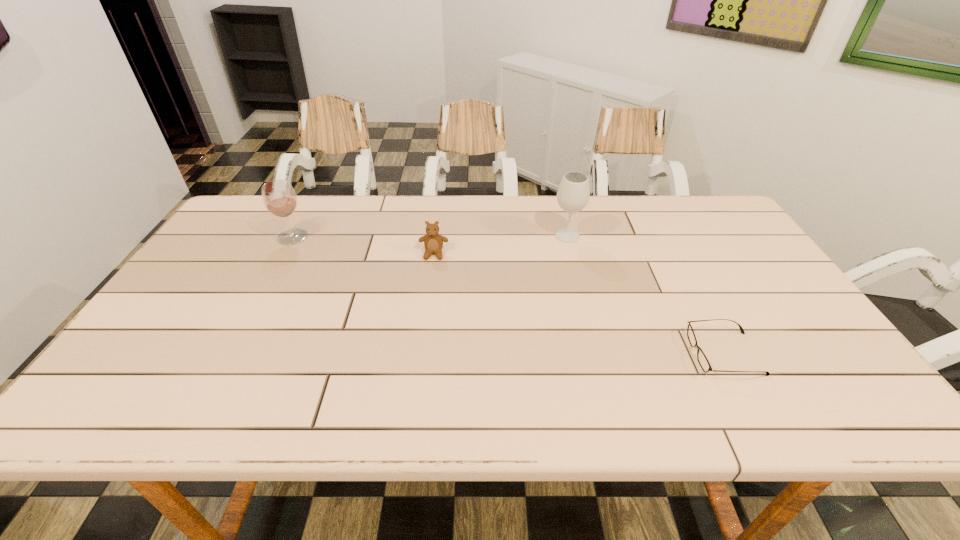
The width and height of the screenshot is (960, 540). Identify the location of vacant region between the left wineglass and the rightmost object. (509, 295).

Find the location of a particular element. The height and width of the screenshot is (540, 960). free space that is in between the third object from right to left and the leftmost object is located at coordinates (363, 245).

Find the location of a particular element. The image size is (960, 540). free area in between the left wineglass and the third farthest object is located at coordinates (363, 245).

Identify the location of vacant point located between the second object from right to left and the spectacles. (646, 295).

The width and height of the screenshot is (960, 540). I want to click on free space between the left wineglass and the spectacles, so click(x=509, y=295).

Find the location of `object identified as the closest to the second object from right to left`. object identified as the closest to the second object from right to left is located at coordinates (433, 242).

Locate which object is the closest to the leftmost object. Please provide its 2D coordinates. Your answer should be formatted as a tuple, i.e. [(x, y)], where the tuple contains the x and y coordinates of a point satisfying the conditions above.

[(433, 242)]